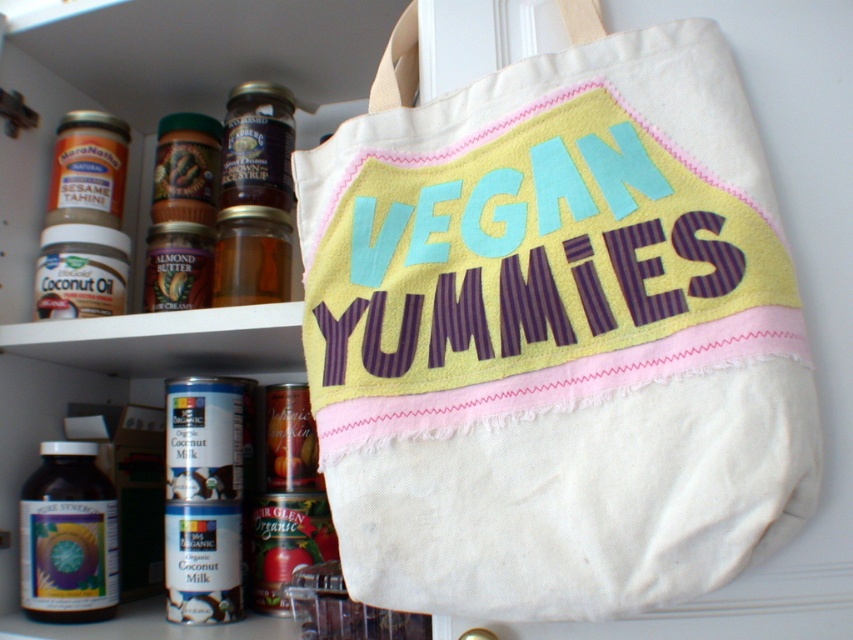
Question: Where is white canvas tote at center located in relation to translucent glass bottle at lower left in the image?

Choices:
 (A) below
 (B) above

Answer: (B)

Question: In this image, where is white canvas tote at center located relative to translucent glass bottle at lower left?

Choices:
 (A) below
 (B) above

Answer: (B)

Question: Is white canvas tote at center behind translucent glass bottle at lower left?

Choices:
 (A) yes
 (B) no

Answer: (B)

Question: Which point is closer to the camera?

Choices:
 (A) (720, 429)
 (B) (73, 608)

Answer: (A)

Question: Which object appears farthest from the camera in this image?

Choices:
 (A) white canvas tote at center
 (B) translucent glass bottle at lower left

Answer: (B)

Question: Which object appears closest to the camera in this image?

Choices:
 (A) white canvas tote at center
 (B) translucent glass bottle at lower left

Answer: (A)